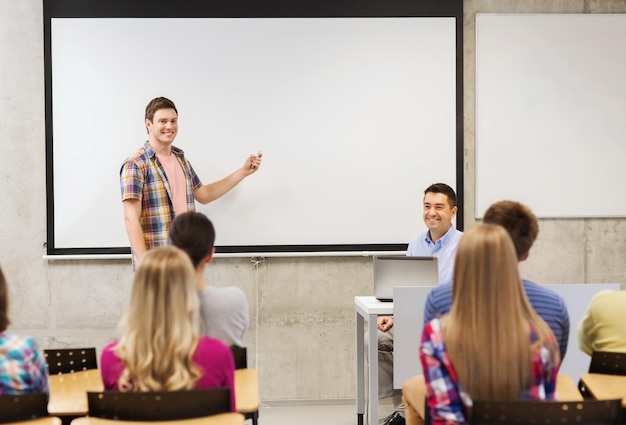
Where is `students in a classroom`? students in a classroom is located at coordinates (525, 217), (480, 321), (598, 309), (217, 310), (146, 306), (16, 370).